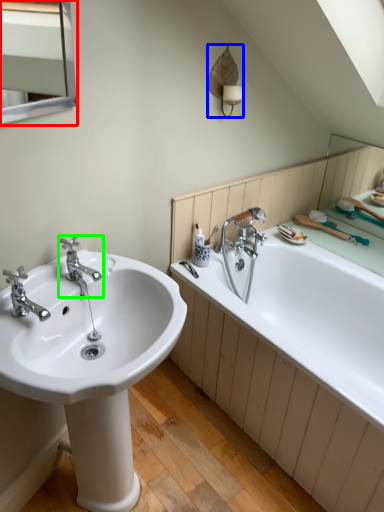
Question: Estimate the real-world distances between objects in this image. Which object is farther from medicine cabinet (highlighted by a red box), fixture (highlighted by a blue box) or tap (highlighted by a green box)?

Choices:
 (A) fixture
 (B) tap

Answer: (B)